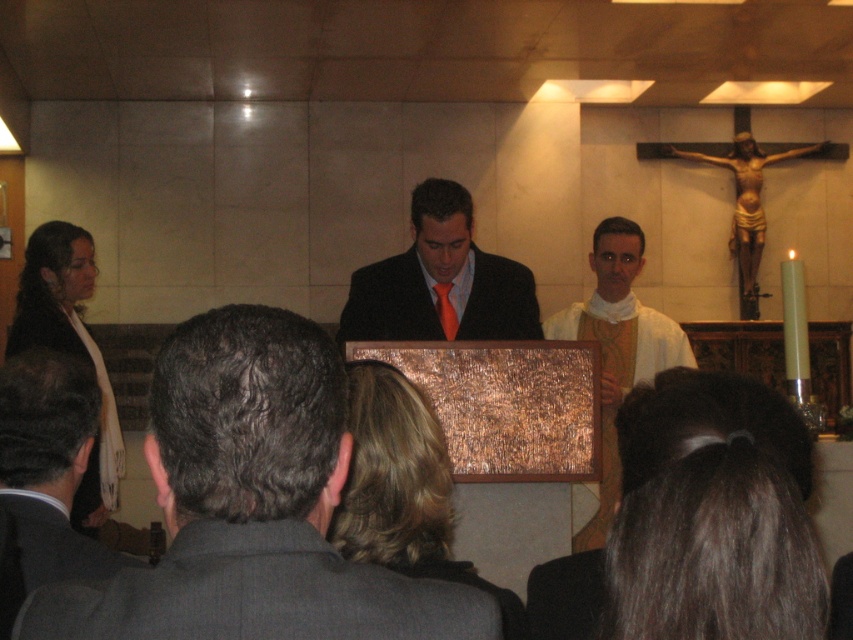
Consider the image. Which is more to the right, gray suit at center or gray wool suit at lower left?

From the viewer's perspective, gray wool suit at lower left appears more on the right side.

Is point (282, 342) more distant than point (421, 618)?

Yes.

Locate an element on the screen. The height and width of the screenshot is (640, 853). gray suit at center is located at coordinates (252, 506).

Does dark brown suit at lower left appear over white cloth at center?

Actually, dark brown suit at lower left is below white cloth at center.

Is dark brown suit at lower left below white cloth at center?

Yes.

Find the location of a particular element. dark brown suit at lower left is located at coordinates (45, 476).

Looking at this image, does gray wool suit at lower left have a lesser height compared to dark brown suit at lower left?

Correct, gray wool suit at lower left is not as tall as dark brown suit at lower left.

What do you see at coordinates (257, 595) in the screenshot?
I see `gray wool suit at lower left` at bounding box center [257, 595].

Find the location of a particular element. gray wool suit at lower left is located at coordinates (257, 595).